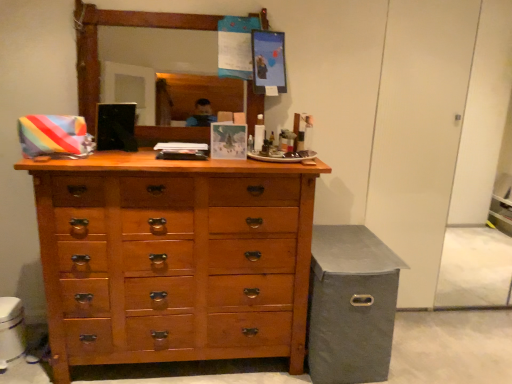
Question: Relative to wooden chest of drawers at center, is gray fabric storage bin at lower right in front or behind?

Choices:
 (A) front
 (B) behind

Answer: (B)

Question: Is gray fabric storage bin at lower right wider or thinner than wooden chest of drawers at center?

Choices:
 (A) wide
 (B) thin

Answer: (A)

Question: Would you say gray fabric storage bin at lower right is to the left or to the right of wooden chest of drawers at center in the picture?

Choices:
 (A) right
 (B) left

Answer: (A)

Question: Does point (165, 254) appear closer or farther from the camera than point (330, 231)?

Choices:
 (A) closer
 (B) farther

Answer: (A)

Question: Relative to gray fabric storage bin at lower right, is wooden chest of drawers at center in front or behind?

Choices:
 (A) behind
 (B) front

Answer: (B)

Question: From the image's perspective, is wooden chest of drawers at center above or below gray fabric storage bin at lower right?

Choices:
 (A) below
 (B) above

Answer: (B)

Question: From a real-world perspective, is wooden chest of drawers at center physically located above or below gray fabric storage bin at lower right?

Choices:
 (A) above
 (B) below

Answer: (A)